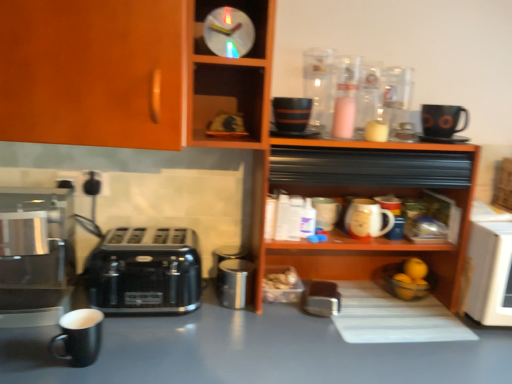
The image size is (512, 384). I want to click on free space above black matte table at lower left (from a real-world perspective), so click(240, 333).